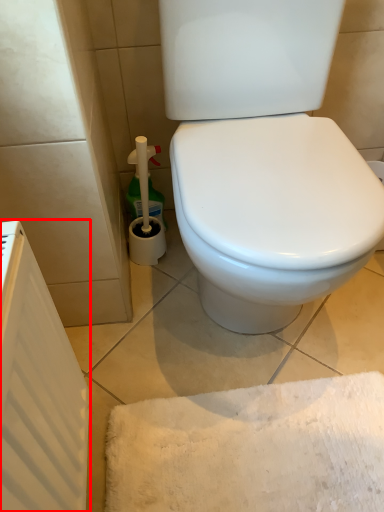
Question: In this image, where is radiator (annotated by the red box) located relative to cleaning product?

Choices:
 (A) right
 (B) left

Answer: (B)